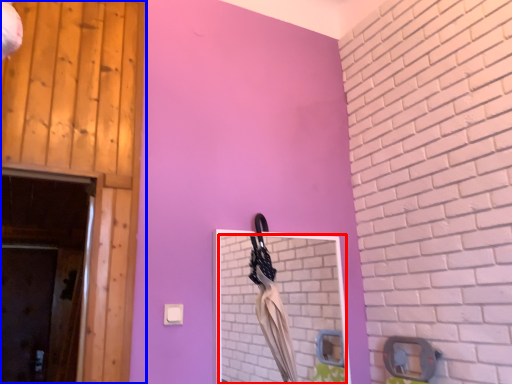
Question: Which object appears farthest to the camera in this image, mirror (highlighted by a red box) or door (highlighted by a blue box)?

Choices:
 (A) mirror
 (B) door

Answer: (A)